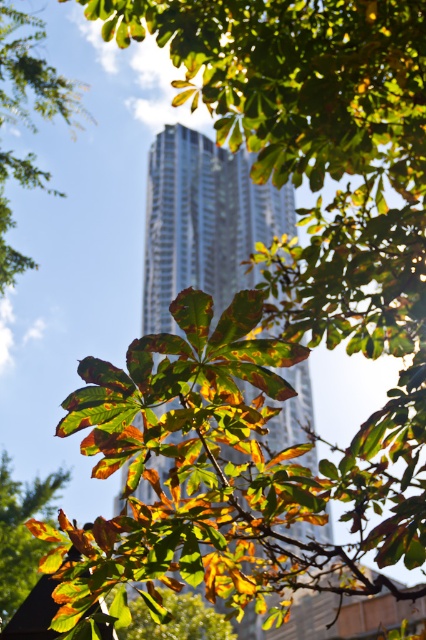
Which is in front, point (28, 116) or point (46, 499)?

Point (28, 116) is more forward.

Is green leafy tree at upper left taller than autumn leaves at center?

No, green leafy tree at upper left is not taller than autumn leaves at center.

Locate an element on the screen. Image resolution: width=426 pixels, height=640 pixels. green leafy tree at upper left is located at coordinates coord(31,74).

Where is `green leafy tree at upper left`? This screenshot has width=426, height=640. green leafy tree at upper left is located at coordinates (31, 74).

Between silver metallic tower at center and autumn leaves at center, which one is positioned lower?

autumn leaves at center

This screenshot has height=640, width=426. Identify the location of silver metallic tower at center. (204, 221).

In the scene shown: Can you confirm if silver metallic tower at center is shorter than green leafy tree at upper left?

No.

The image size is (426, 640). What do you see at coordinates (204, 221) in the screenshot? I see `silver metallic tower at center` at bounding box center [204, 221].

The height and width of the screenshot is (640, 426). What do you see at coordinates (204, 221) in the screenshot?
I see `silver metallic tower at center` at bounding box center [204, 221].

At what (x,y) coordinates should I click in order to perform the action: click on silver metallic tower at center. Please return your answer as a coordinate pair (x, y). Looking at the image, I should click on (204, 221).